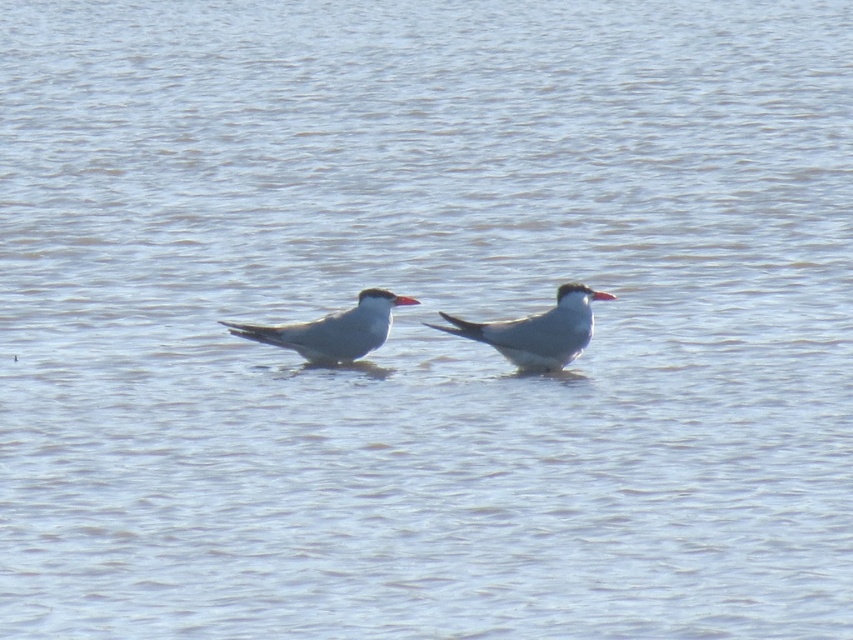
Question: Among these objects, which one is farthest from the camera?

Choices:
 (A) matte red beak at center
 (B) white glossy seagull at center

Answer: (B)

Question: Considering the relative positions of white glossy bird at center and matte red beak at center in the image provided, where is white glossy bird at center located with respect to matte red beak at center?

Choices:
 (A) left
 (B) right

Answer: (B)

Question: Can you confirm if white glossy bird at center is positioned to the left of matte red beak at center?

Choices:
 (A) no
 (B) yes

Answer: (A)

Question: Which is farther from the matte red beak at center?

Choices:
 (A) white glossy seagull at center
 (B) red glossy beak at center
 (C) white glossy bird at center

Answer: (B)

Question: Which of the following is the farthest from the observer?

Choices:
 (A) (405, 296)
 (B) (608, 292)
 (C) (548, 346)

Answer: (A)

Question: Does white glossy bird at center have a smaller size compared to matte red beak at center?

Choices:
 (A) no
 (B) yes

Answer: (A)